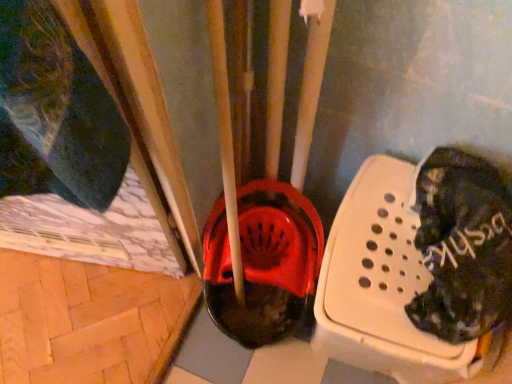
Question: From a real-world perspective, is black fabric shoe at right positioned above or below dark blue fabric at left?

Choices:
 (A) above
 (B) below

Answer: (A)

Question: In the image, is black fabric shoe at right on the left side or the right side of dark blue fabric at left?

Choices:
 (A) right
 (B) left

Answer: (A)

Question: Looking at their shapes, would you say black fabric shoe at right is wider or thinner than dark blue fabric at left?

Choices:
 (A) thin
 (B) wide

Answer: (B)

Question: Considering the positions of dark blue fabric at left and black fabric shoe at right in the image, is dark blue fabric at left taller or shorter than black fabric shoe at right?

Choices:
 (A) short
 (B) tall

Answer: (B)

Question: Is dark blue fabric at left wider or thinner than black fabric shoe at right?

Choices:
 (A) wide
 (B) thin

Answer: (B)

Question: Is point (6, 79) closer or farther from the camera than point (488, 188)?

Choices:
 (A) farther
 (B) closer

Answer: (B)

Question: Which is correct: dark blue fabric at left is inside black fabric shoe at right, or outside of it?

Choices:
 (A) inside
 (B) outside

Answer: (B)